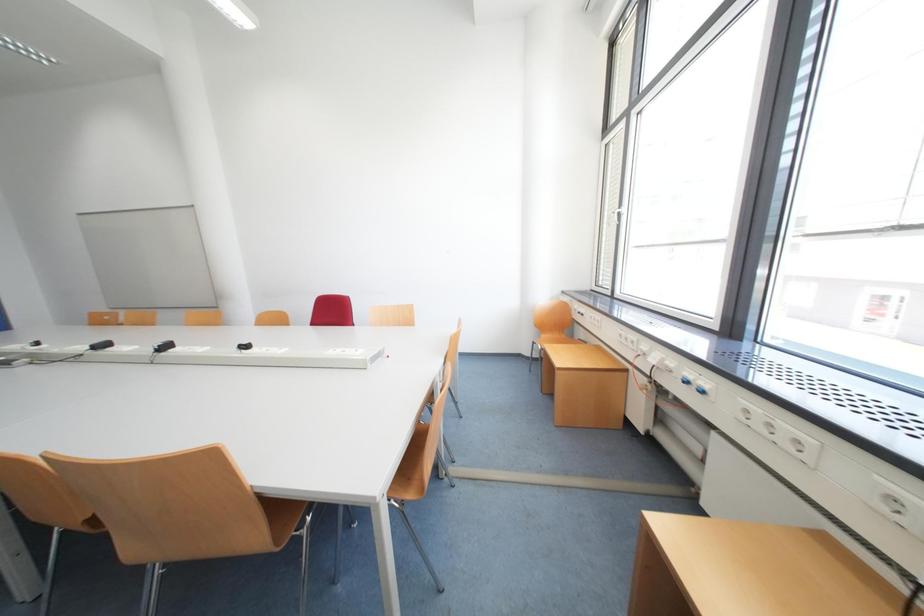
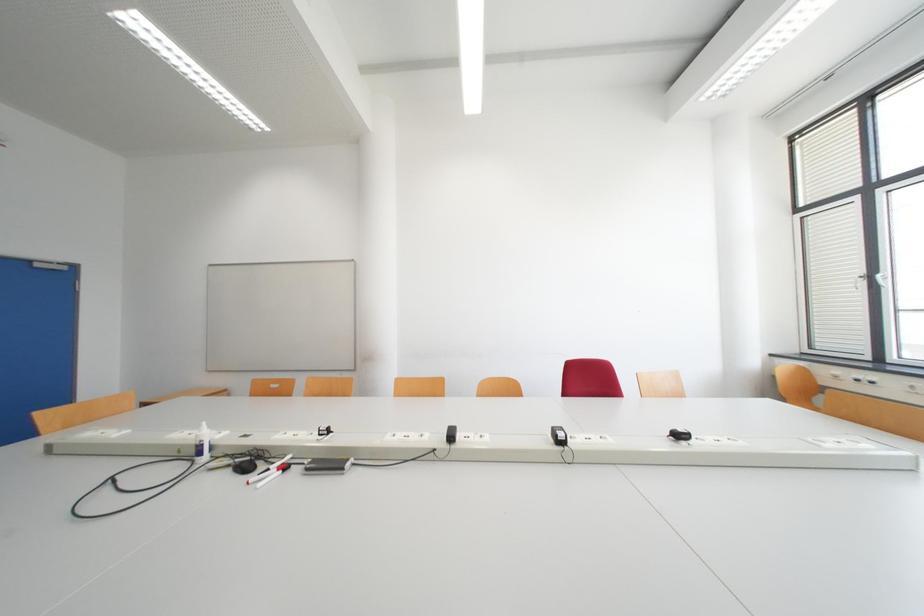
Question: In a continuous first-person perspective shot, in which direction is the camera moving?

Choices:
 (A) Left
 (B) Right
 (C) Forward
 (D) Backward

Answer: (A)